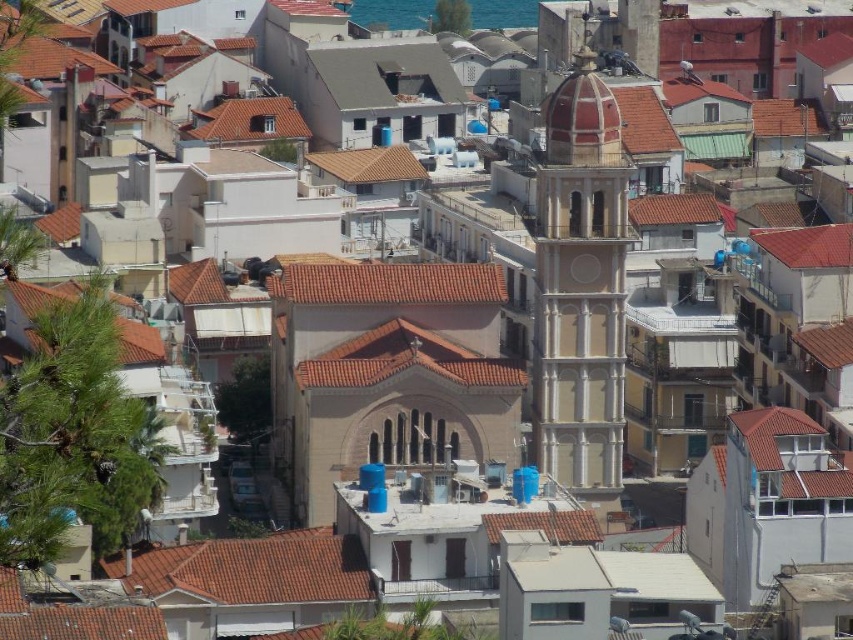
You are standing in the center of the urban landscape and want to take a photo. There are two points of interest marked as point [288,348] and point [561,150]. Which point is closer to your camera when taking the photo?

Point [288,348] is further to the camera than point [561,150], so the point closer to the camera is point [561,150].

You are a drone operator planning to fly a drone over the urban area shown in the image. The drone has a maximum flight altitude of 100 meters. Given the location of the brown textured church at center, can you determine if the drone will be able to safely pass over the church without exceeding its altitude limit?

The brown textured church at center has a bell tower with a dome at the top painted in a reddish hue. The drone operator must consider the height of the bell tower. If the bell tower exceeds 100 meters, the drone cannot safely pass over without exceeding its altitude limit. However, the provided information does not specify the height of the bell tower, so it is impossible to determine if the drone can safely pass over the church without exceeding its altitude limit based solely on the given data.